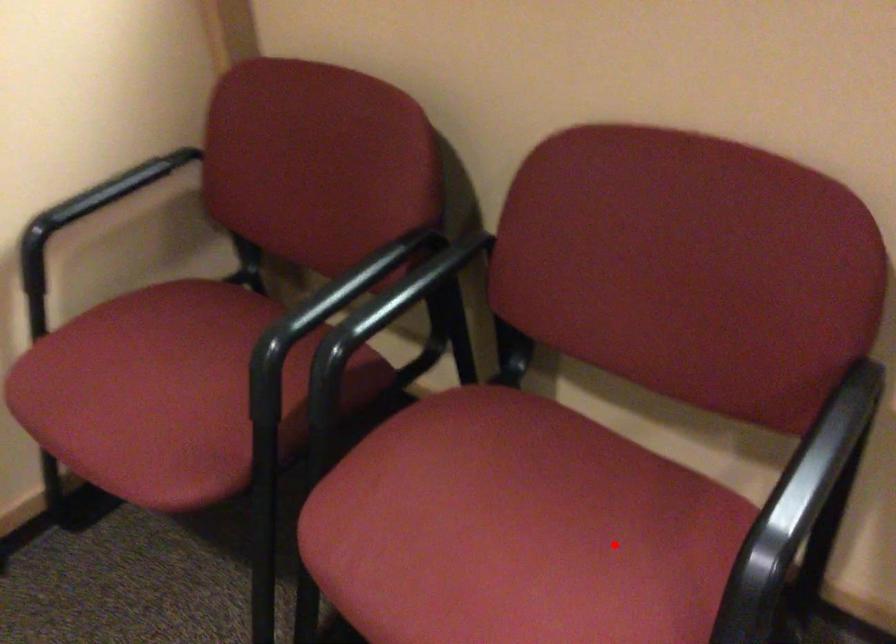
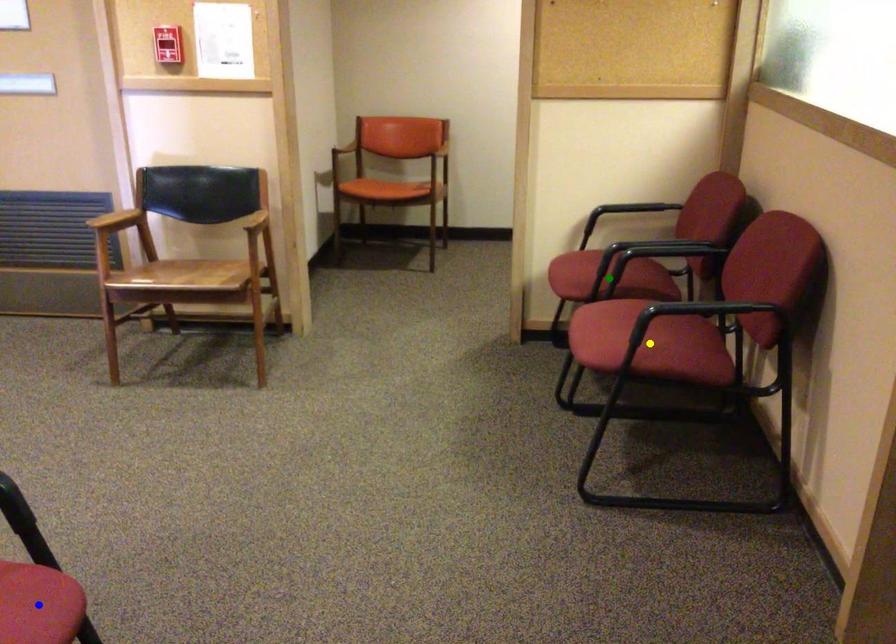
Question: I am providing you with two images of the same scene from different viewpoints. A red point is marked on the first image. You are given multiple points on the second image. In image 2, which mark is for the same physical point as the one in image 1?

Choices:
 (A) yellow point
 (B) green point
 (C) blue point

Answer: (A)